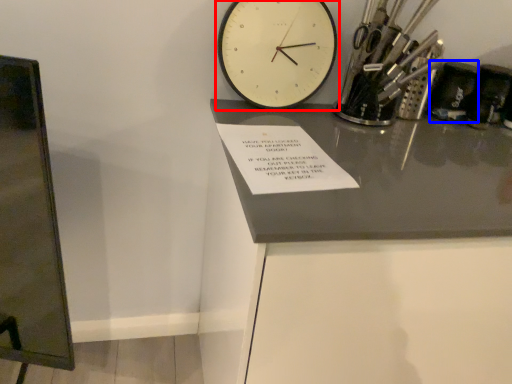
Question: Which object appears farthest to the camera in this image, wall clock (highlighted by a red box) or stationery (highlighted by a blue box)?

Choices:
 (A) wall clock
 (B) stationery

Answer: (B)